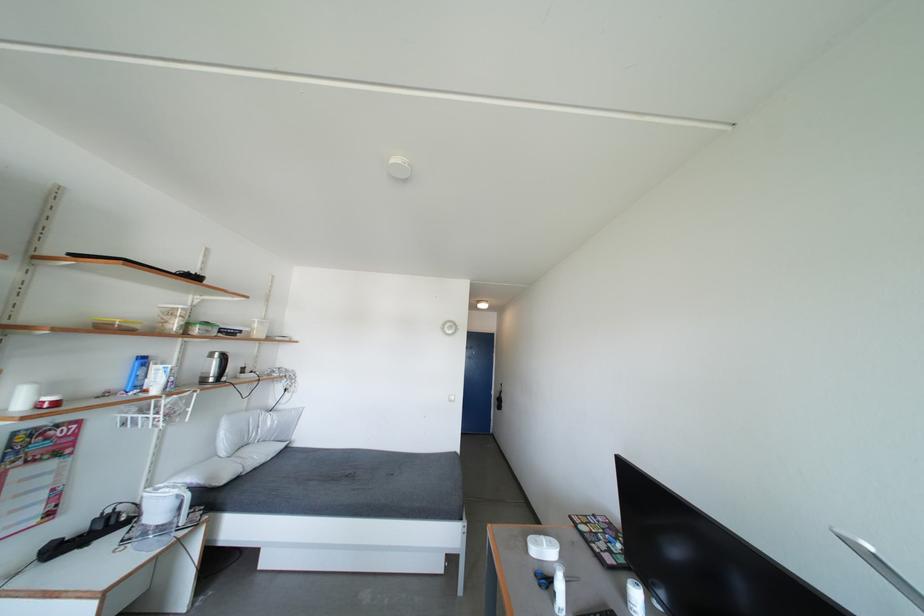
This screenshot has height=616, width=924. What do you see at coordinates (550, 578) in the screenshot?
I see `a scissors handles` at bounding box center [550, 578].